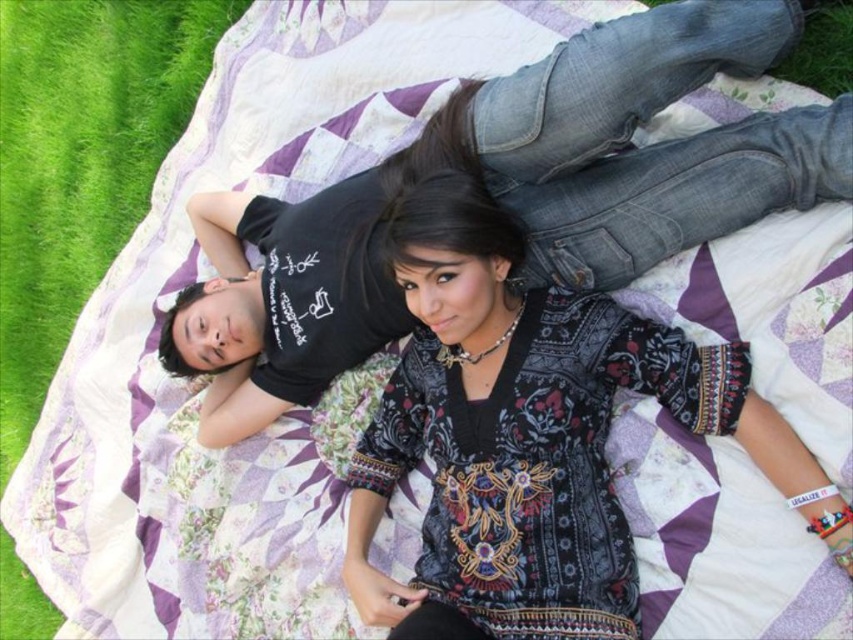
You are planning to take a photo of the patterned fabric dress at center and the green grass at left. Which object is positioned lower in the image?

The patterned fabric dress at center is located below green grass at left, so the patterned fabric dress at center is positioned lower in the image.

You are standing at the origin point in the image and want to locate the patterned fabric dress at center. Which direction should you move to find it?

The patterned fabric dress at center is located at point 0.681 in the x direction and 0.625 in the y direction. Since you are at the origin, you should move right along the x axis and up along the y axis to reach it.

You are taking a photo of the scene and want to focus on the two points in the image. Which point, point (520, 429) or point (15, 397), is closer to the camera?

Point (520, 429) is closer to the camera than point (15, 397).